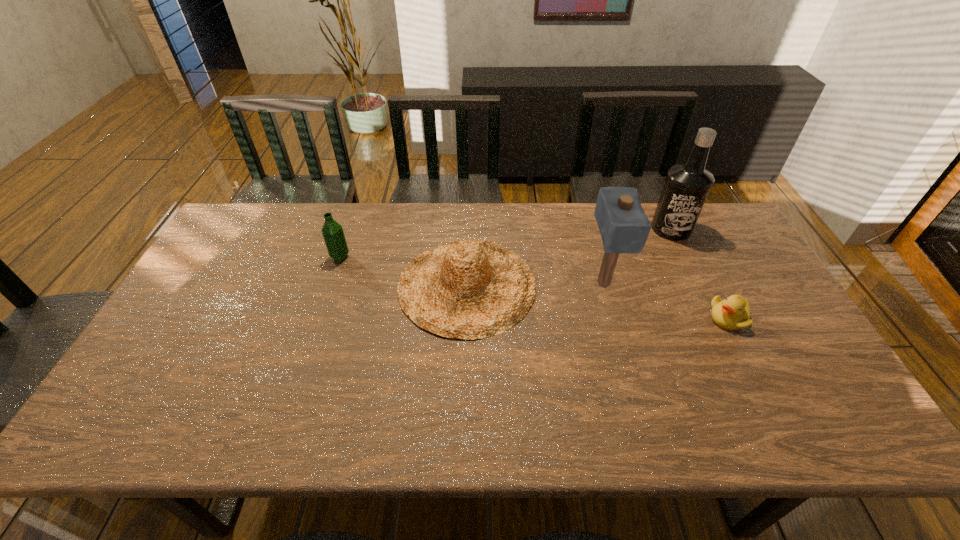
Locate an element on the screen. liquor is located at coordinates (687, 185).

Where is `mallet`? The image size is (960, 540). mallet is located at coordinates (624, 227).

At what (x,y) coordinates should I click in order to perform the action: click on the second tallest object. Please return your answer as a coordinate pair (x, y). Image resolution: width=960 pixels, height=540 pixels. Looking at the image, I should click on (624, 227).

Locate an element on the screen. the third tallest object is located at coordinates (333, 233).

Find the location of a particular element. the leftmost object is located at coordinates (333, 233).

Locate an element on the screen. the fourth object from right to left is located at coordinates (468, 289).

Locate an element on the screen. the fourth tallest object is located at coordinates (468, 289).

What are the coordinates of `the shortest object` in the screenshot? It's located at (732, 313).

Where is `vacant area situated 0.310m on the front label of the liquor`? This screenshot has width=960, height=540. vacant area situated 0.310m on the front label of the liquor is located at coordinates (713, 314).

At what (x,y) coordinates should I click in order to perform the action: click on free location located 0.260m on the back of the mallet. Please return your answer as a coordinate pair (x, y). The height and width of the screenshot is (540, 960). Looking at the image, I should click on (584, 213).